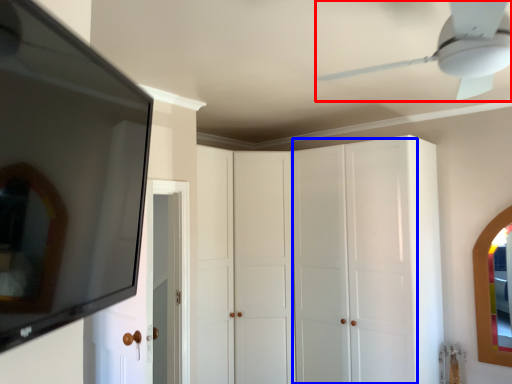
Question: Among these objects, which one is farthest to the camera, ceiling fan (highlighted by a red box) or glass door (highlighted by a blue box)?

Choices:
 (A) ceiling fan
 (B) glass door

Answer: (B)